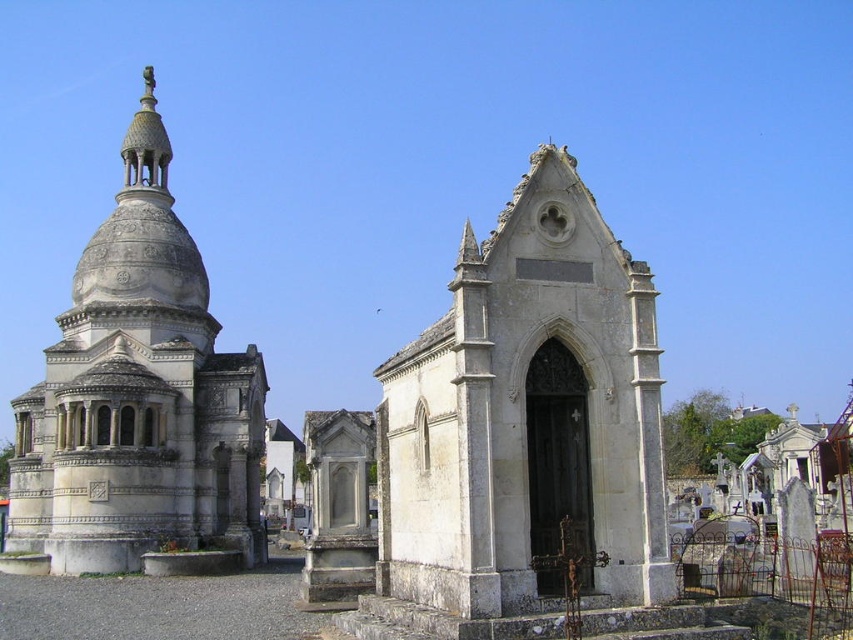
Question: Is white stone chapel at center smaller than white stone dome at left?

Choices:
 (A) no
 (B) yes

Answer: (B)

Question: Which point is farther from the camera taking this photo?

Choices:
 (A) (426, 504)
 (B) (140, 161)

Answer: (B)

Question: Is white stone chapel at center bigger than white stone dome at left?

Choices:
 (A) yes
 (B) no

Answer: (B)

Question: Which of the following is the closest to the observer?

Choices:
 (A) (602, 364)
 (B) (178, 220)

Answer: (A)

Question: Among these points, which one is farthest from the camera?

Choices:
 (A) (141, 300)
 (B) (379, 532)

Answer: (A)

Question: Is white stone chapel at center to the right of white stone dome at left from the viewer's perspective?

Choices:
 (A) no
 (B) yes

Answer: (B)